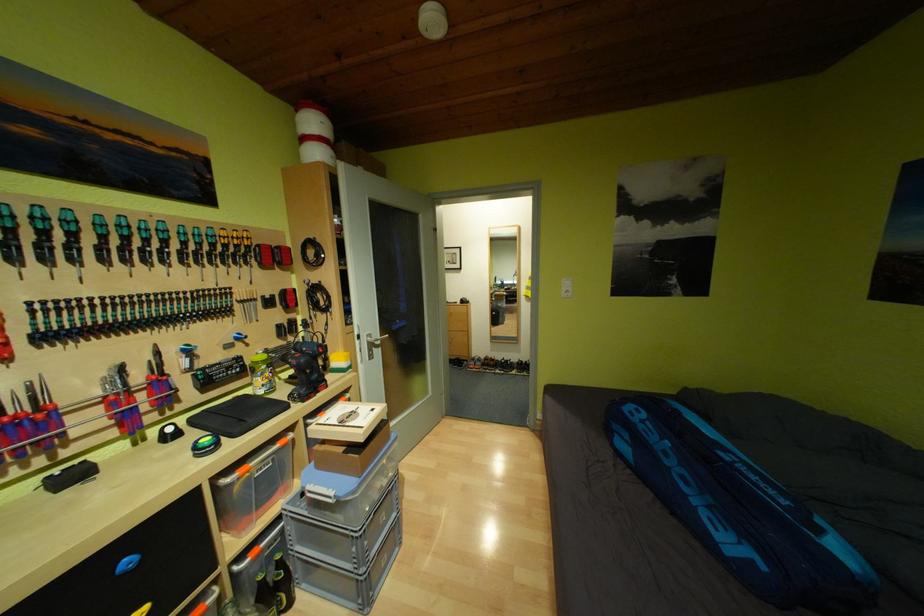
The height and width of the screenshot is (616, 924). What are the coordinates of `white door handle` in the screenshot? It's located at (365, 344).